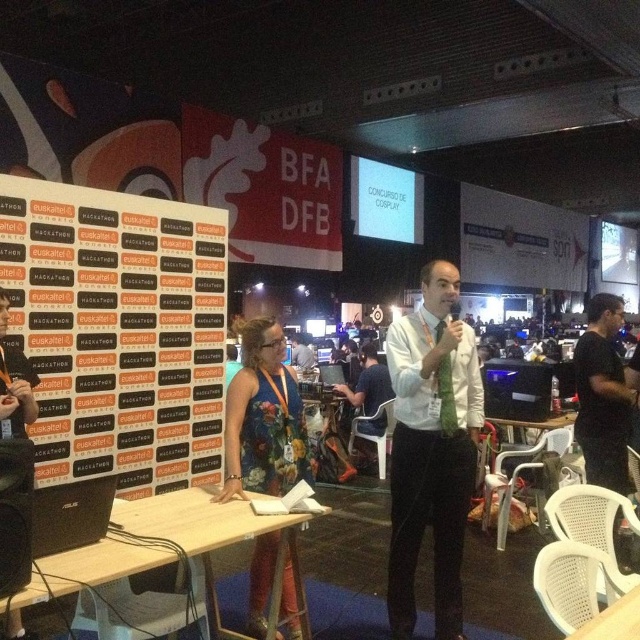
You are standing at the entrance of the event hall and want to locate the white paperboard at left. According to the coordinates provided, where should you look relative to the entrance?

The white paperboard at left is located at coordinates point (118, 332), which would be to the left side of the entrance area.

You are organizing a presentation and need to place a 1.5 meter tall screen between the white paperboard at left and the white shirt at center. Can the screen fit vertically between them based on their heights?

The white paperboard at left is much taller than the white shirt at center, so the screen may not fit vertically between them since the paperboard is taller than the screen height requirement.